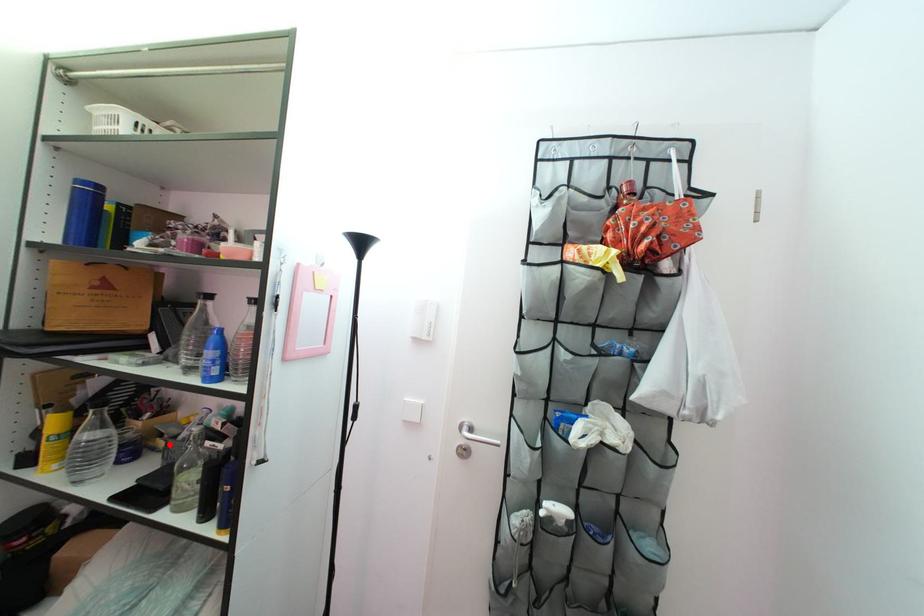
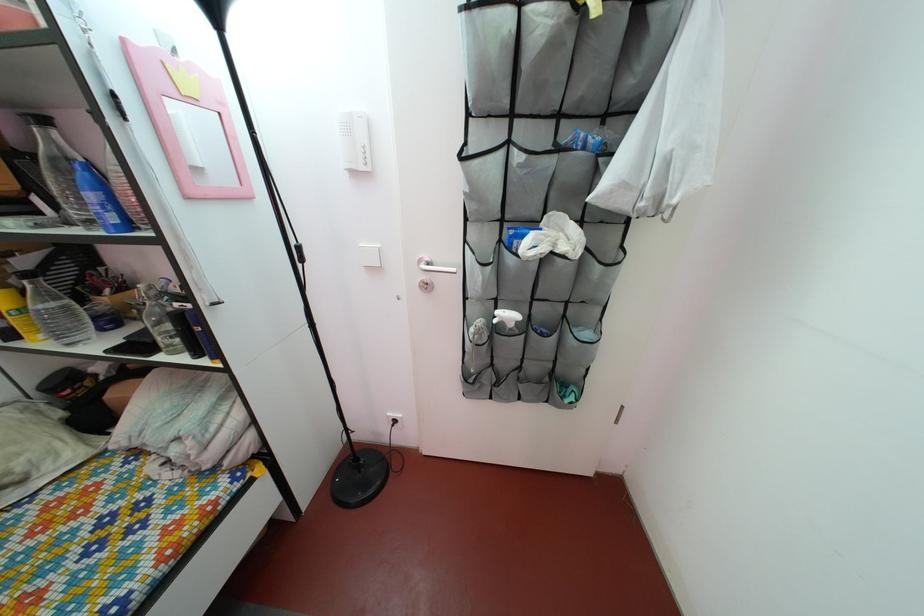
Question: I am providing you with two images of the same scene from different viewpoints. A red point is marked on the first image. Is the red point's position out of view in image 2?

Choices:
 (A) Yes
 (B) No

Answer: (B)